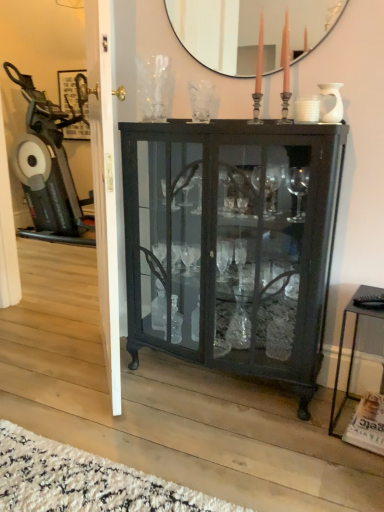
What do you see at coordinates (104, 187) in the screenshot? I see `white glossy door at center` at bounding box center [104, 187].

Describe the element at coordinates (352, 348) in the screenshot. I see `black metal side table at lower right` at that location.

Locate an element on the screen. matte black mirror at upper center is located at coordinates (250, 31).

This screenshot has width=384, height=512. What do you see at coordinates (250, 31) in the screenshot?
I see `matte black mirror at upper center` at bounding box center [250, 31].

Identify the location of white glossy door at center. (104, 187).

Which is behind, point (347, 379) or point (239, 287)?

The point (239, 287) is farther from the camera.

Considering the relative sizes of black metal side table at lower right and matte black cabinet at center in the image provided, is black metal side table at lower right taller than matte black cabinet at center?

Incorrect, the height of black metal side table at lower right is not larger of that of matte black cabinet at center.

What's the angular difference between black metal side table at lower right and matte black cabinet at center's facing directions?

black metal side table at lower right and matte black cabinet at center are facing 5.83 degrees away from each other.

The width and height of the screenshot is (384, 512). What are the coordinates of `cupboard located above the black metal side table at lower right (from a real-world perspective)` in the screenshot? It's located at (231, 244).

From the image's perspective, is matte black mirror at upper center located above or below black metal side table at lower right?

Based on their image positions, matte black mirror at upper center is located above black metal side table at lower right.

Where is `table that appears below the matte black mirror at upper center (from the image's perspective)`? table that appears below the matte black mirror at upper center (from the image's perspective) is located at coordinates (352, 348).

Which is more to the right, matte black mirror at upper center or black metal side table at lower right?

black metal side table at lower right.

In terms of size, does matte black mirror at upper center appear bigger or smaller than black metal side table at lower right?

matte black mirror at upper center is smaller than black metal side table at lower right.

Is the position of white shag rug at lower left more distant than that of white glossy door at center?

No, the depth of white shag rug at lower left is less than that of white glossy door at center.

Is white shag rug at lower left spatially inside white glossy door at center, or outside of it?

white shag rug at lower left cannot be found inside white glossy door at center.

Considering the sizes of objects white shag rug at lower left and white glossy door at center in the image provided, who is shorter, white shag rug at lower left or white glossy door at center?

Standing shorter between the two is white shag rug at lower left.

What's the angular difference between white shag rug at lower left and white glossy door at center's facing directions?

The angle between the facing direction of white shag rug at lower left and the facing direction of white glossy door at center is 130 degrees.

From the image's perspective, is matte black mirror at upper center beneath white glossy door at center?

No.

Is matte black mirror at upper center bigger than white glossy door at center?

No.

Is matte black mirror at upper center further to the viewer compared to white glossy door at center?

Yes, matte black mirror at upper center is further from the viewer.

Is white shag rug at lower left positioned with its back to matte black mirror at upper center?

No, matte black mirror at upper center is not at the back of white shag rug at lower left.

Is white shag rug at lower left to the right of matte black mirror at upper center from the viewer's perspective?

In fact, white shag rug at lower left is to the left of matte black mirror at upper center.

Looking at their sizes, would you say white shag rug at lower left is wider or thinner than matte black mirror at upper center?

Considering their sizes, white shag rug at lower left looks broader than matte black mirror at upper center.

How far apart are white shag rug at lower left and matte black mirror at upper center?

They are 1.92 meters apart.

Does white glossy door at center turn towards matte black mirror at upper center?

No, white glossy door at center is not turned towards matte black mirror at upper center.

Does white glossy door at center lie behind matte black mirror at upper center?

That is False.

Identify the location of screen door lying below the matte black mirror at upper center (from the image's perspective). (104, 187).

Considering the sizes of objects white glossy door at center and matte black mirror at upper center in the image provided, who is taller, white glossy door at center or matte black mirror at upper center?

Standing taller between the two is white glossy door at center.

Is point (327, 158) farther from camera compared to point (88, 1)?

No, it is in front of (88, 1).

Locate an element on the screen. Image resolution: width=384 pixels, height=512 pixels. cupboard located underneath the white glossy door at center (from a real-world perspective) is located at coordinates (231, 244).

Is matte black cabinet at center beside white glossy door at center?

matte black cabinet at center and white glossy door at center are clearly separated.

Find the location of a particular element. cupboard above the black metal side table at lower right (from a real-world perspective) is located at coordinates (231, 244).

The width and height of the screenshot is (384, 512). I want to click on table beneath the matte black mirror at upper center (from a real-world perspective), so click(x=352, y=348).

Based on their spatial positions, is matte black cabinet at center or white shag rug at lower left further from matte black mirror at upper center?

white shag rug at lower left is positioned further to the anchor matte black mirror at upper center.

When comparing their distances from white shag rug at lower left, does black metal side table at lower right or white glossy door at center seem further?

The object further to white shag rug at lower left is black metal side table at lower right.

From the image, which object appears to be farther from white glossy door at center, white shag rug at lower left or matte black mirror at upper center?

matte black mirror at upper center is further to white glossy door at center.

Based on their spatial positions, is matte black cabinet at center or black metal side table at lower right closer to white glossy door at center?

matte black cabinet at center is positioned closer to the anchor white glossy door at center.

Based on their spatial positions, is white glossy door at center or white shag rug at lower left further from matte black cabinet at center?

white shag rug at lower left is further to matte black cabinet at center.

Based on their spatial positions, is black metal side table at lower right or white shag rug at lower left closer to matte black cabinet at center?

Among the two, black metal side table at lower right is located nearer to matte black cabinet at center.

Estimate the real-world distances between objects in this image. Which object is closer to matte black mirror at upper center, white shag rug at lower left or matte black cabinet at center?

Among the two, matte black cabinet at center is located nearer to matte black mirror at upper center.

Considering their positions, is white glossy door at center positioned further to black metal side table at lower right than white shag rug at lower left?

white glossy door at center is positioned further to the anchor black metal side table at lower right.

Where is `screen door between matte black mirror at upper center and white shag rug at lower left vertically`? The height and width of the screenshot is (512, 384). screen door between matte black mirror at upper center and white shag rug at lower left vertically is located at coordinates (104, 187).

What are the coordinates of `plain between white glossy door at center and black metal side table at lower right` in the screenshot? It's located at (84, 481).

Identify the location of cupboard between white glossy door at center and black metal side table at lower right. (231, 244).

Image resolution: width=384 pixels, height=512 pixels. I want to click on cupboard situated between white shag rug at lower left and black metal side table at lower right from left to right, so click(x=231, y=244).